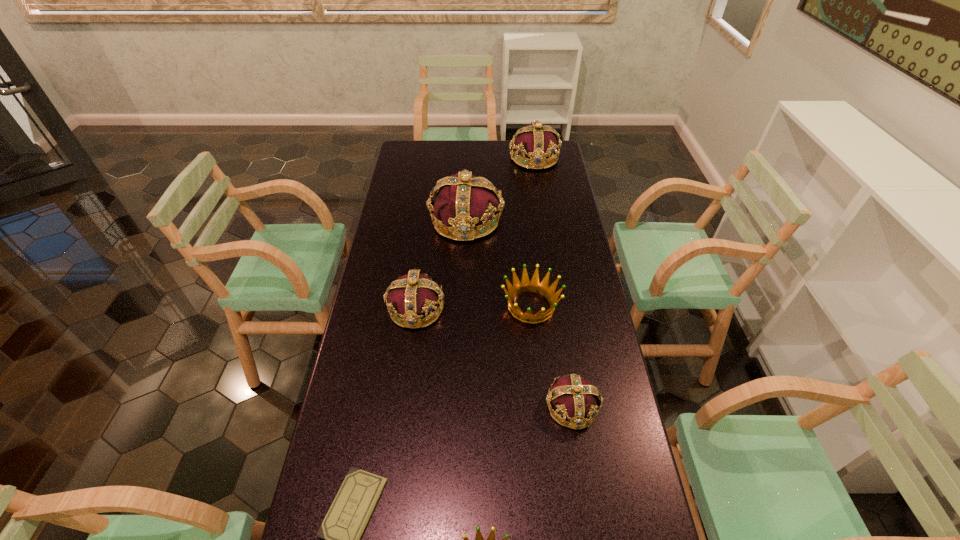
Identify which purple crown is the third nearest to the fifth farthest object. Please provide its 2D coordinates. Your answer should be formatted as a tuple, i.e. [(x, y)], where the tuple contains the x and y coordinates of a point satisfying the conditions above.

[(535, 142)]

Identify which purple crown is the closest to the farther golden crown. Please provide its 2D coordinates. Your answer should be formatted as a tuple, i.e. [(x, y)], where the tuple contains the x and y coordinates of a point satisfying the conditions above.

[(414, 295)]